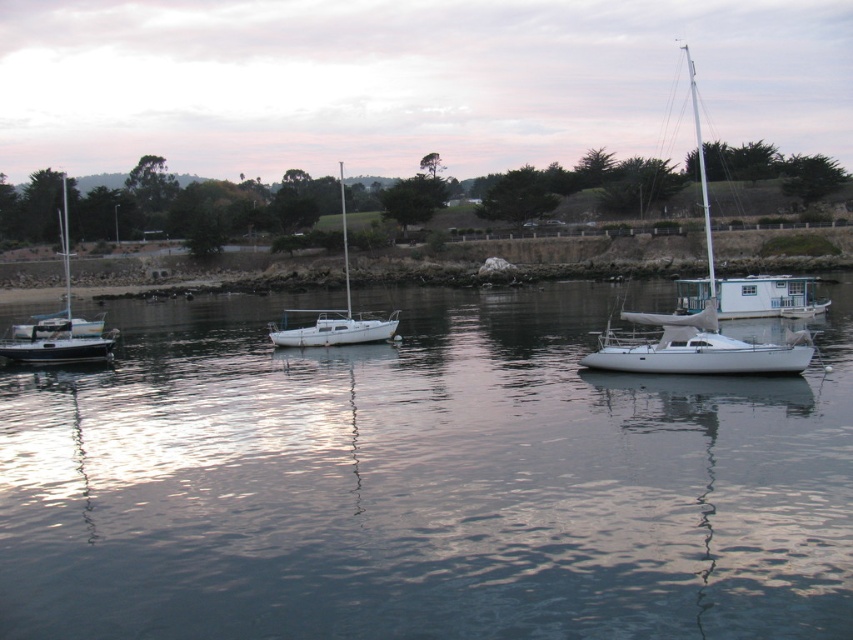
Who is taller, white glossy sailboat at right or white matte sailboat at center?

With more height is white glossy sailboat at right.

This screenshot has height=640, width=853. What are the coordinates of `white glossy sailboat at right` in the screenshot? It's located at (701, 320).

Where is `transparent water at center`? Image resolution: width=853 pixels, height=640 pixels. transparent water at center is located at coordinates (421, 481).

Does transparent water at center have a lesser width compared to white matte sailboat at center?

No, transparent water at center is not thinner than white matte sailboat at center.

Find the location of `transparent water at center`. transparent water at center is located at coordinates (421, 481).

Is transparent water at center smaller than white matte sailboat at left?

Yes, transparent water at center is smaller than white matte sailboat at left.

Looking at this image, which is below, transparent water at center or white matte sailboat at left?

transparent water at center

Is point (724, 413) closer to camera compared to point (94, 333)?

Yes, it is.

I want to click on transparent water at center, so click(421, 481).